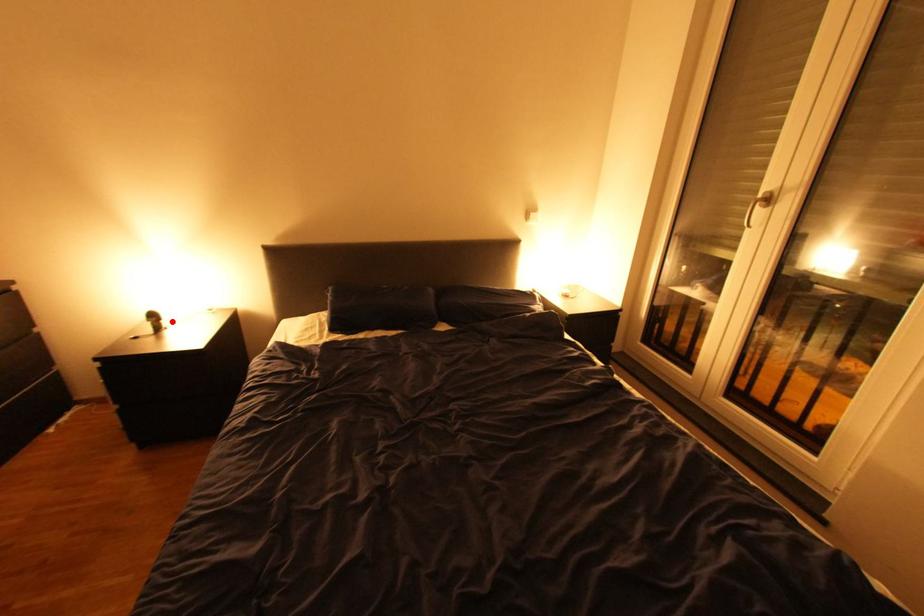
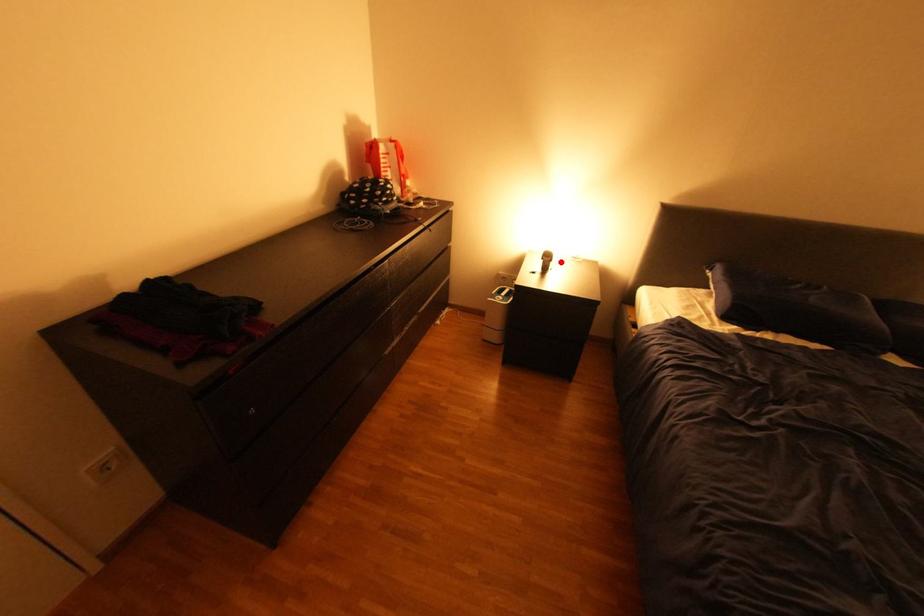
I am providing you with two images of the same scene from different viewpoints. A red point is marked on the first image and another point is marked on the second image. Is the red point in image1 aligned with the point shown in image2?

Yes